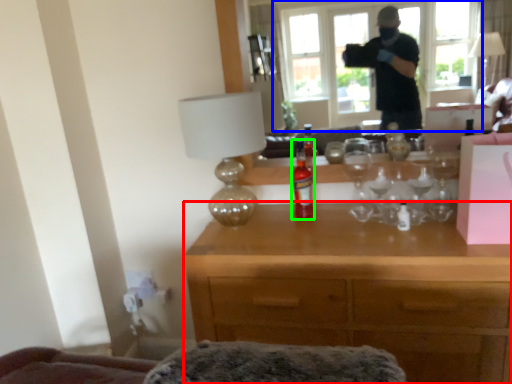
Question: Considering the real-world distances, which object is farthest from desk (highlighted by a red box)? window (highlighted by a blue box) or bottle (highlighted by a green box)?

Choices:
 (A) window
 (B) bottle

Answer: (A)